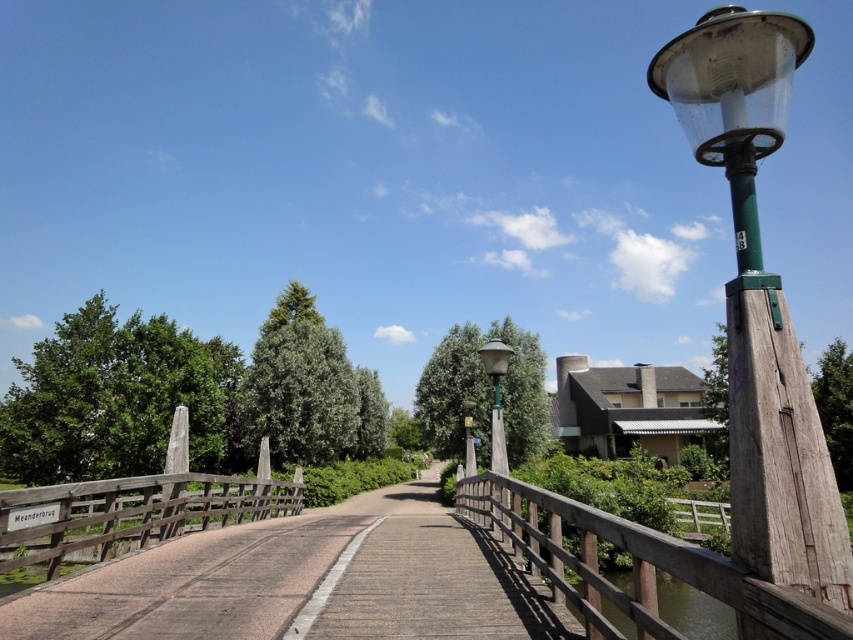
Does wooden bridge at right appear under green matte street light at center?

Yes.

Is wooden bridge at right positioned behind green matte street light at center?

No.

Find the location of a particular element. This screenshot has width=853, height=640. wooden bridge at right is located at coordinates click(x=637, y=566).

The width and height of the screenshot is (853, 640). I want to click on wooden bridge at right, so click(637, 566).

Does transparent water at center appear on the left side of green matte street light at center?

In fact, transparent water at center is to the right of green matte street light at center.

Does transparent water at center appear on the right side of green matte street light at center?

Indeed, transparent water at center is positioned on the right side of green matte street light at center.

Which is in front, point (624, 628) or point (502, 454)?

Positioned in front is point (502, 454).

Where is `transparent water at center`? The width and height of the screenshot is (853, 640). transparent water at center is located at coordinates (693, 611).

Does wooden bridge at right have a greater height compared to transparent water at center?

No.

What are the coordinates of `wooden bridge at right` in the screenshot? It's located at (637, 566).

Which is behind, point (512, 541) or point (675, 621)?

The point (675, 621) is more distant.

Image resolution: width=853 pixels, height=640 pixels. I want to click on wooden bridge at right, so click(x=637, y=566).